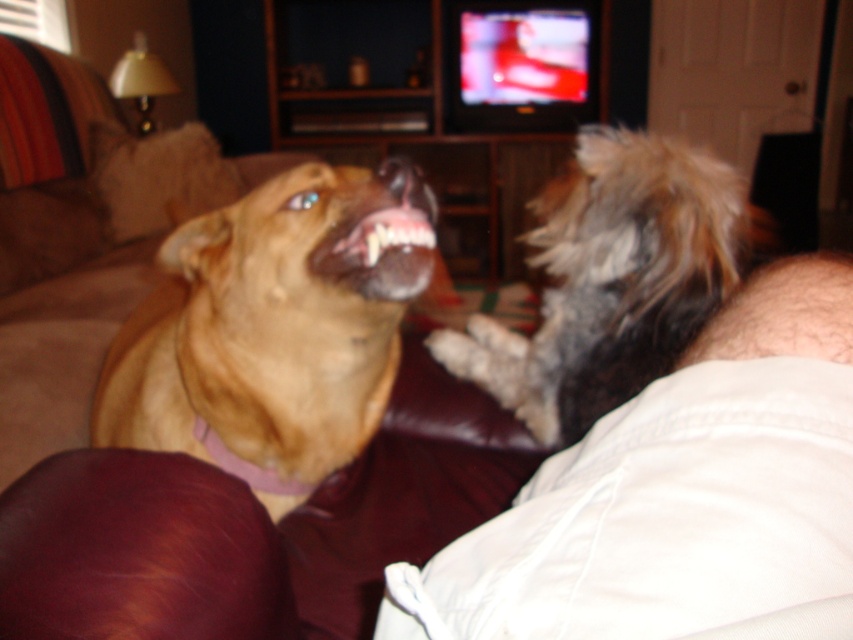
You are a dog trainer observing the scene. You notice a point at coordinates (194, 458). What object does this point correspond to?

The point at coordinates (194, 458) corresponds to the brown leather couch at upper left.

You are trying to place a decorative pillow on the brown leather couch at upper left. However, there is already a matte brown teeth at center on it. Can the pillow fit on the couch without displacing the teeth?

The brown leather couch at upper left might be wider than matte brown teeth at center, so there is a possibility that the pillow can fit without displacing the teeth, but it depends on the exact dimensions of both items.

You are a photographer trying to capture a candid shot of both dogs. You notice two points marked in the scene. The first point is at coordinates point [248,522], and the second point is at coordinates point [345,244]. Which point should you focus on to ensure both dogs are in the frame?

Point [248,522] is in front of point [345,244], so focusing on point [248,522] will ensure both dogs are in the frame since it is closer to the viewer.